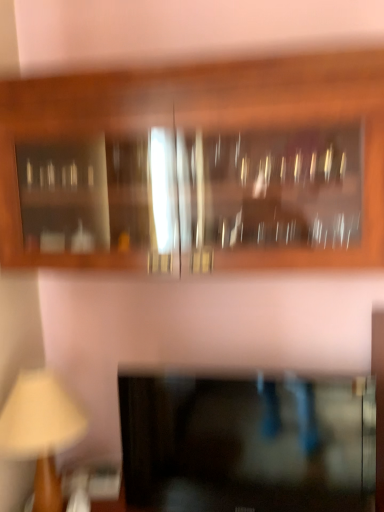
The width and height of the screenshot is (384, 512). What do you see at coordinates (41, 430) in the screenshot? I see `wooden beige table lamp at lower left` at bounding box center [41, 430].

The width and height of the screenshot is (384, 512). Identify the location of black glass cabinet at lower center, which ranks as the second cabinetry in top-to-bottom order. click(x=248, y=443).

From a real-world perspective, is black glass cabinet at lower center, which ranks as the second cabinetry in top-to-bottom order, physically located above or below wooden cabinet at upper center, marked as the 1th cabinetry in a top-to-bottom arrangement?

In terms of real-world spatial position, black glass cabinet at lower center, which ranks as the second cabinetry in top-to-bottom order, is below wooden cabinet at upper center, marked as the 1th cabinetry in a top-to-bottom arrangement.

Does black glass cabinet at lower center, which ranks as the second cabinetry in top-to-bottom order, have a smaller size compared to wooden cabinet at upper center, the second cabinetry from the bottom?

Correct, black glass cabinet at lower center, which ranks as the second cabinetry in top-to-bottom order, occupies less space than wooden cabinet at upper center, the second cabinetry from the bottom.

Would you say black glass cabinet at lower center, which ranks as the second cabinetry in top-to-bottom order, contains wooden cabinet at upper center, marked as the 1th cabinetry in a top-to-bottom arrangement?

No, wooden cabinet at upper center, marked as the 1th cabinetry in a top-to-bottom arrangement, is not a part of black glass cabinet at lower center, which ranks as the second cabinetry in top-to-bottom order.

Is black glass cabinet at lower center, which ranks as the second cabinetry in top-to-bottom order, facing towards wooden cabinet at upper center, the second cabinetry from the bottom?

No.

Considering the points (34, 424) and (271, 76), which point is behind, point (34, 424) or point (271, 76)?

The point (34, 424) is farther.

From the picture: From a real-world perspective, relative to wooden cabinet at upper center, marked as the 1th cabinetry in a top-to-bottom arrangement, is wooden beige table lamp at lower left vertically above or below?

wooden beige table lamp at lower left is situated lower than wooden cabinet at upper center, marked as the 1th cabinetry in a top-to-bottom arrangement, in the real world.

In terms of width, does wooden beige table lamp at lower left look wider or thinner when compared to wooden cabinet at upper center, the second cabinetry from the bottom?

Clearly, wooden beige table lamp at lower left has less width compared to wooden cabinet at upper center, the second cabinetry from the bottom.

Can you see wooden beige table lamp at lower left touching wooden cabinet at upper center, marked as the 1th cabinetry in a top-to-bottom arrangement?

No, wooden beige table lamp at lower left is not with wooden cabinet at upper center, marked as the 1th cabinetry in a top-to-bottom arrangement.

From a real-world perspective, relative to wooden beige table lamp at lower left, is wooden cabinet at upper center, marked as the 1th cabinetry in a top-to-bottom arrangement, vertically above or below?

wooden cabinet at upper center, marked as the 1th cabinetry in a top-to-bottom arrangement, is situated higher than wooden beige table lamp at lower left in the real world.

Who is bigger, wooden cabinet at upper center, the second cabinetry from the bottom, or wooden beige table lamp at lower left?

With larger size is wooden cabinet at upper center, the second cabinetry from the bottom.

From the image's perspective, would you say wooden cabinet at upper center, the second cabinetry from the bottom, is positioned over wooden beige table lamp at lower left?

Yes.

Is wooden cabinet at upper center, marked as the 1th cabinetry in a top-to-bottom arrangement, closer to the viewer compared to wooden beige table lamp at lower left?

That is True.

Image resolution: width=384 pixels, height=512 pixels. In order to click on table lamp located on the left of black glass cabinet at lower center, the first cabinetry ordered from the bottom in this screenshot , I will do `click(41, 430)`.

Is black glass cabinet at lower center, which ranks as the second cabinetry in top-to-bottom order, not close to wooden beige table lamp at lower left?

black glass cabinet at lower center, which ranks as the second cabinetry in top-to-bottom order, is near wooden beige table lamp at lower left, not far away.

In terms of width, does black glass cabinet at lower center, the first cabinetry ordered from the bottom, look wider or thinner when compared to wooden beige table lamp at lower left?

black glass cabinet at lower center, the first cabinetry ordered from the bottom, is thinner than wooden beige table lamp at lower left.

Which object is closer to the camera taking this photo, wooden beige table lamp at lower left or black glass cabinet at lower center, the first cabinetry ordered from the bottom?

black glass cabinet at lower center, the first cabinetry ordered from the bottom, is in front.

Which object is positioned more to the right, wooden beige table lamp at lower left or black glass cabinet at lower center, which ranks as the second cabinetry in top-to-bottom order?

From the viewer's perspective, black glass cabinet at lower center, which ranks as the second cabinetry in top-to-bottom order, appears more on the right side.

From a real-world perspective, who is located higher, wooden beige table lamp at lower left or black glass cabinet at lower center, the first cabinetry ordered from the bottom?

wooden beige table lamp at lower left is physically above.

Looking at this image, is wooden beige table lamp at lower left facing away from black glass cabinet at lower center, which ranks as the second cabinetry in top-to-bottom order?

No, black glass cabinet at lower center, which ranks as the second cabinetry in top-to-bottom order, is not at the back of wooden beige table lamp at lower left.

From the image's perspective, between wooden cabinet at upper center, the second cabinetry from the bottom, and black glass cabinet at lower center, the first cabinetry ordered from the bottom, who is located below?

black glass cabinet at lower center, the first cabinetry ordered from the bottom, from the image's perspective.

Can you confirm if wooden cabinet at upper center, the second cabinetry from the bottom, is smaller than black glass cabinet at lower center, which ranks as the second cabinetry in top-to-bottom order?

No.

Is wooden cabinet at upper center, the second cabinetry from the bottom, facing away from black glass cabinet at lower center, the first cabinetry ordered from the bottom?

wooden cabinet at upper center, the second cabinetry from the bottom, is not turned away from black glass cabinet at lower center, the first cabinetry ordered from the bottom.

You are a GUI agent. You are given a task and a screenshot of the screen. Output one action in this format:
    pyautogui.click(x=<x>, y=<y>)
    Task: Click on the cabinetry on the right of the wooden cabinet at upper center, the second cabinetry from the bottom
    The height and width of the screenshot is (512, 384).
    Given the screenshot: What is the action you would take?
    pyautogui.click(x=248, y=443)

Find the location of a particular element. The image size is (384, 512). cabinetry located above the wooden beige table lamp at lower left (from a real-world perspective) is located at coordinates (197, 166).

In the scene shown: From the image, which object appears to be nearer to wooden beige table lamp at lower left, black glass cabinet at lower center, the first cabinetry ordered from the bottom, or wooden cabinet at upper center, the second cabinetry from the bottom?

black glass cabinet at lower center, the first cabinetry ordered from the bottom, is closer to wooden beige table lamp at lower left.

Considering their positions, is wooden beige table lamp at lower left positioned closer to black glass cabinet at lower center, the first cabinetry ordered from the bottom, than wooden cabinet at upper center, marked as the 1th cabinetry in a top-to-bottom arrangement?

wooden beige table lamp at lower left is positioned closer to the anchor black glass cabinet at lower center, the first cabinetry ordered from the bottom.

Considering their positions, is wooden beige table lamp at lower left positioned closer to wooden cabinet at upper center, marked as the 1th cabinetry in a top-to-bottom arrangement, than black glass cabinet at lower center, the first cabinetry ordered from the bottom?

black glass cabinet at lower center, the first cabinetry ordered from the bottom, is positioned closer to the anchor wooden cabinet at upper center, marked as the 1th cabinetry in a top-to-bottom arrangement.

Considering their positions, is wooden cabinet at upper center, marked as the 1th cabinetry in a top-to-bottom arrangement, positioned further to wooden beige table lamp at lower left than black glass cabinet at lower center, the first cabinetry ordered from the bottom?

wooden cabinet at upper center, marked as the 1th cabinetry in a top-to-bottom arrangement.

In the scene shown: Estimate the real-world distances between objects in this image. Which object is closer to black glass cabinet at lower center, which ranks as the second cabinetry in top-to-bottom order, wooden cabinet at upper center, the second cabinetry from the bottom, or wooden beige table lamp at lower left?

Among the two, wooden beige table lamp at lower left is located nearer to black glass cabinet at lower center, which ranks as the second cabinetry in top-to-bottom order.

In the scene shown: Based on their spatial positions, is black glass cabinet at lower center, which ranks as the second cabinetry in top-to-bottom order, or wooden beige table lamp at lower left further from wooden cabinet at upper center, the second cabinetry from the bottom?

wooden beige table lamp at lower left is further to wooden cabinet at upper center, the second cabinetry from the bottom.

Locate an element on the screen. The image size is (384, 512). cabinetry between wooden cabinet at upper center, marked as the 1th cabinetry in a top-to-bottom arrangement, and wooden beige table lamp at lower left, in the vertical direction is located at coordinates (248, 443).